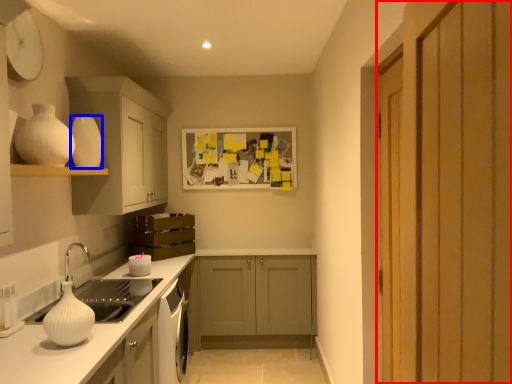
Question: Which object is closer to the camera taking this photo, door (highlighted by a red box) or vase (highlighted by a blue box)?

Choices:
 (A) door
 (B) vase

Answer: (A)